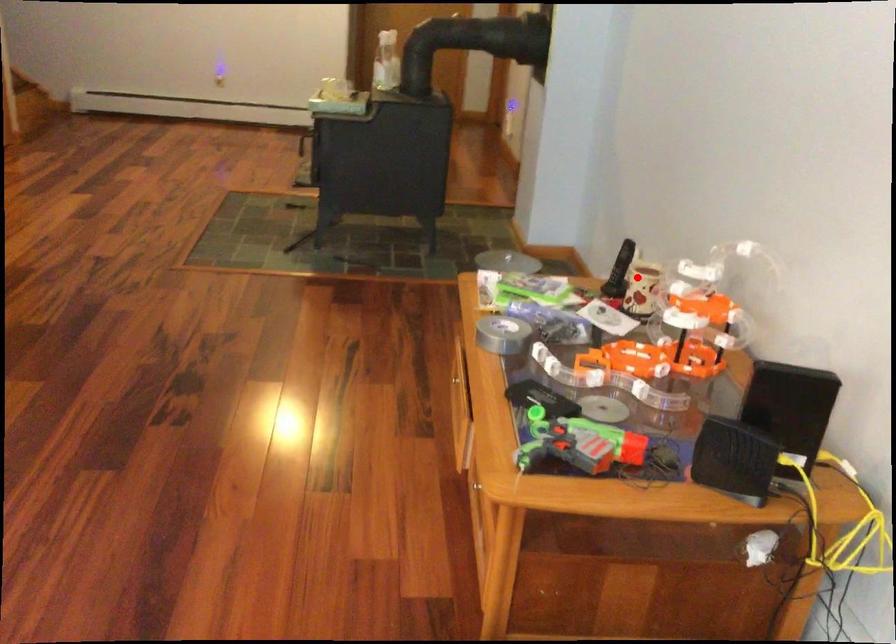
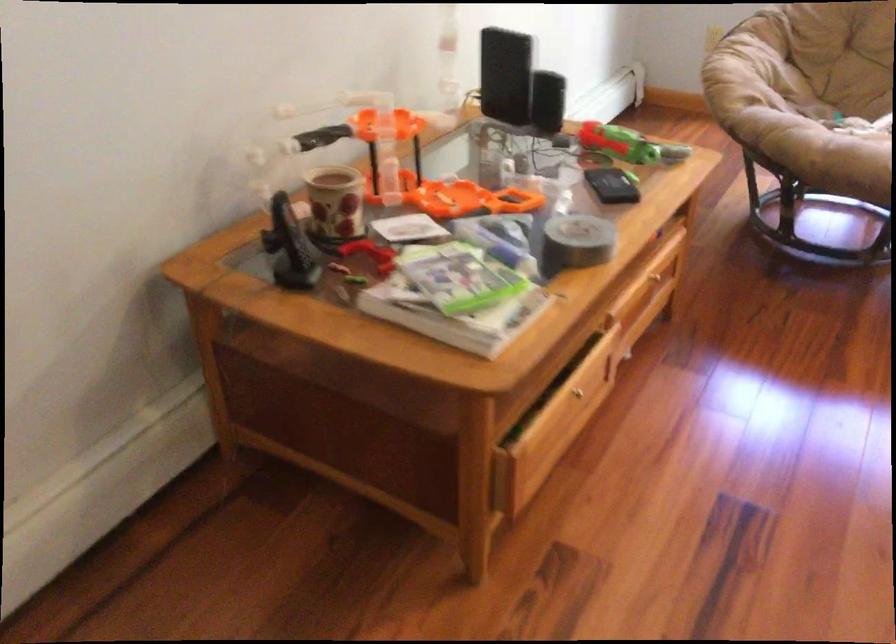
Question: I am providing you with two images of the same scene from different viewpoints. A red point is shown in image1. For the corresponding object point in image2, is it positioned nearer or farther from the camera?

Choices:
 (A) Nearer
 (B) Farther

Answer: (A)